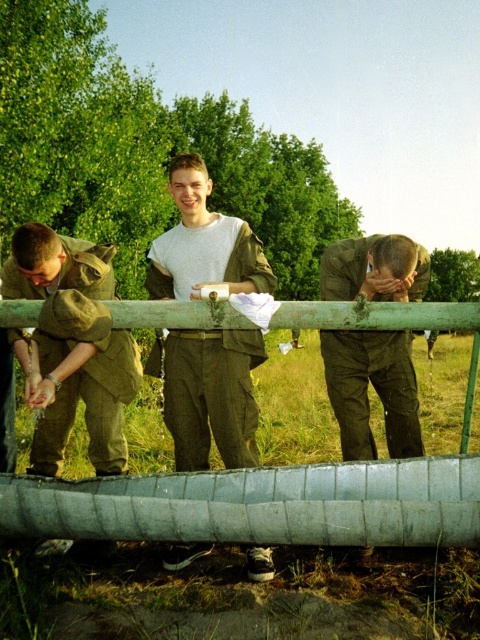
Question: Does gray rubber canoe at center have a larger size compared to matte khaki pants at center?

Choices:
 (A) yes
 (B) no

Answer: (B)

Question: Which object appears farthest from the camera in this image?

Choices:
 (A) matte olive green uniform at center
 (B) matte khaki pants at center
 (C) camouflage fabric uniform at left
 (D) green painted metal rail at center

Answer: (B)

Question: Among these points, which one is farthest from the camera?

Choices:
 (A) (384, 280)
 (B) (92, 396)
 (C) (200, 323)
 (D) (292, 492)

Answer: (D)

Question: Does camouflage fabric uniform at left have a greater width compared to matte olive green uniform at center?

Choices:
 (A) no
 (B) yes

Answer: (B)

Question: Is matte olive green uniform at center positioned behind green painted metal rail at center?

Choices:
 (A) no
 (B) yes

Answer: (B)

Question: Which point appears closest to the camera in this image?

Choices:
 (A) (137, 534)
 (B) (109, 308)
 (C) (357, 433)

Answer: (B)